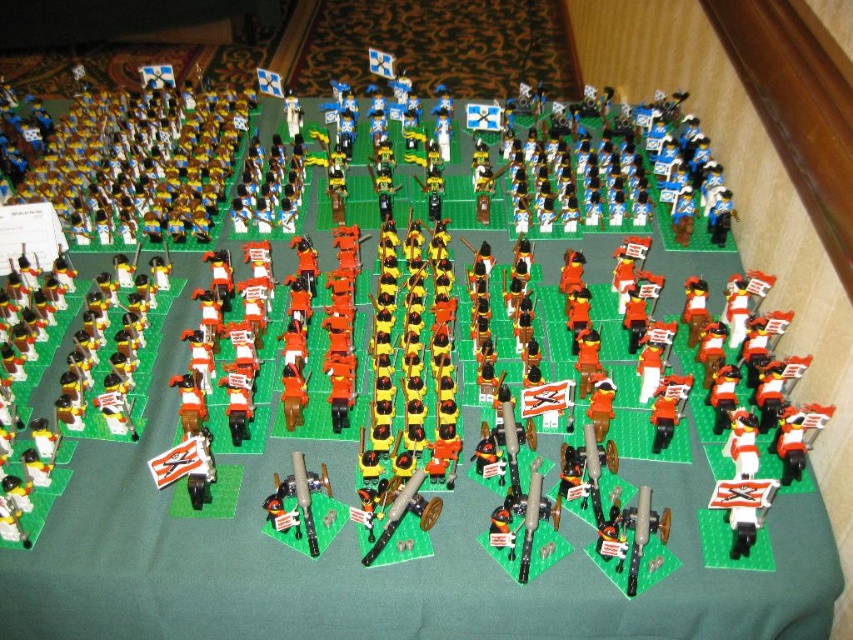
You are a photographer setting up a shot of the toy soldiers display. You need to focus on the point at position (x=409, y=525) and the point at (x=192, y=433). Which point should you focus on first to ensure proper depth of field?

You should focus on point (x=409, y=525) first because it is closer to the camera than point (x=192, y=433), ensuring the depth of field captures both points effectively.

You are a museum curator planning to display the wooden cannon at center and the metallic cannon at center side by side. Given their sizes, which cannon should be placed on the left to ensure proper visual balance?

The wooden cannon at center is larger in size than the metallic cannon at center, so placing the larger wooden cannon at center on the left and the smaller metallic cannon at center on the right will create a balanced display.